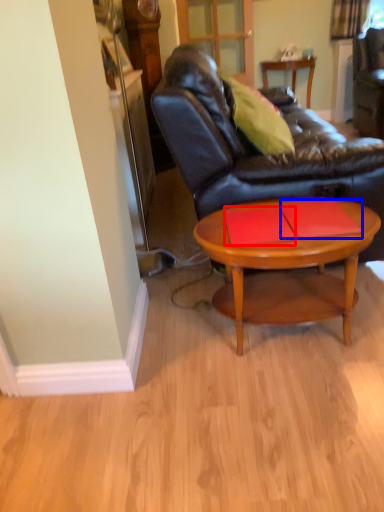
Question: Which of the following is the closest to the observer, plank (highlighted by a red box) or plank (highlighted by a blue box)?

Choices:
 (A) plank
 (B) plank

Answer: (B)